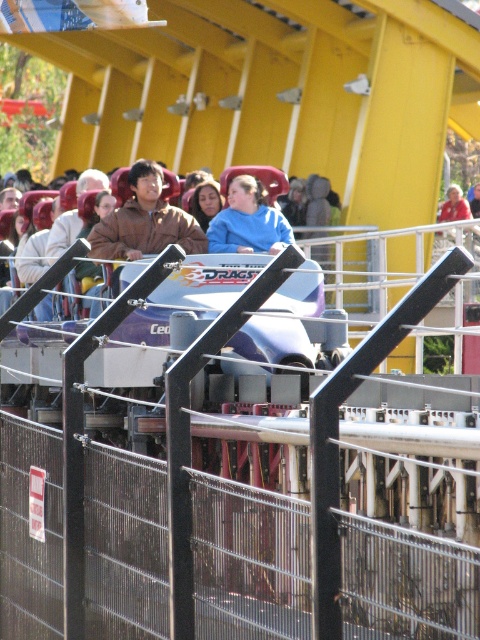
Question: Is brown leather jacket at center below red shirt at center?

Choices:
 (A) yes
 (B) no

Answer: (A)

Question: Where is brown leather jacket at center located in relation to red shirt at center in the image?

Choices:
 (A) above
 (B) below

Answer: (B)

Question: Which point appears farthest from the camera in this image?

Choices:
 (A) (222, 248)
 (B) (456, 211)
 (C) (48, 307)

Answer: (B)

Question: Does brown leather jacket at center come behind red shirt at center?

Choices:
 (A) yes
 (B) no

Answer: (B)

Question: Which point is farther to the camera?

Choices:
 (A) red shirt at center
 (B) blue matte shirt at center

Answer: (A)

Question: Which object is the closest to the blue matte shirt at center?

Choices:
 (A) brown leather jacket at center
 (B) red shirt at center

Answer: (A)